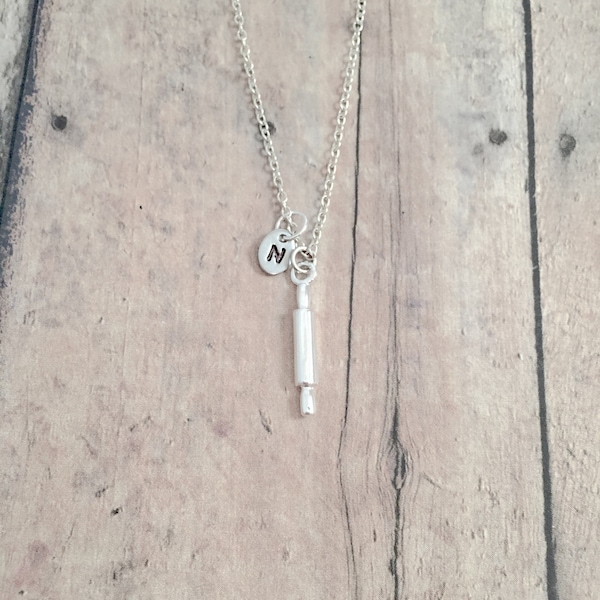
Find the location of `edge of wooden board`. edge of wooden board is located at coordinates (549, 491), (10, 163).